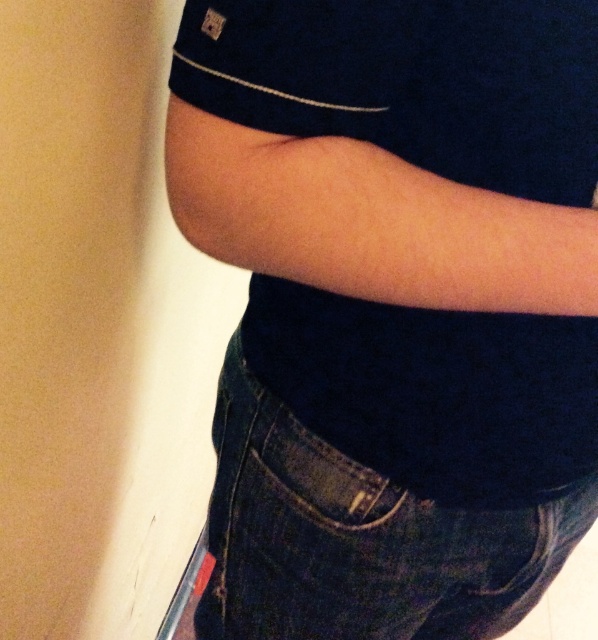
Does point (352, 516) lie in front of point (322, 554)?

Yes.

Is dark blue cotton shirt at center in front of dark blue denim jeans at lower center?

Yes, dark blue cotton shirt at center is closer to the viewer.

Does point (431, 310) come farther from viewer compared to point (315, 440)?

That is False.

Image resolution: width=598 pixels, height=640 pixels. In order to click on dark blue cotton shirt at center in this screenshot , I will do `click(393, 307)`.